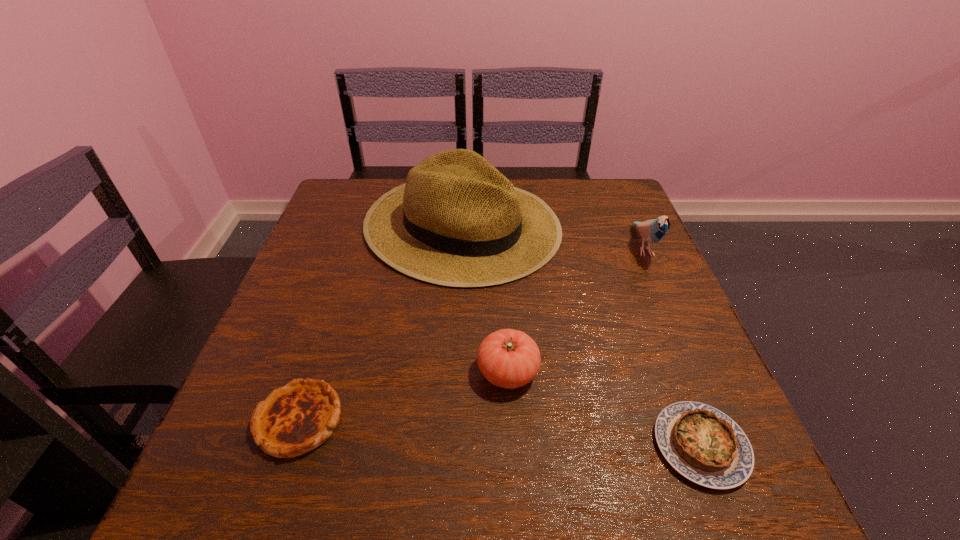
Where is `vacant space at the far edge of the desktop`? The image size is (960, 540). vacant space at the far edge of the desktop is located at coordinates (570, 227).

What are the coordinates of `blank area at the near edge` in the screenshot? It's located at (399, 481).

The width and height of the screenshot is (960, 540). In order to click on vacant space at the left edge of the desktop in this screenshot , I will do `click(346, 269)`.

The height and width of the screenshot is (540, 960). In order to click on vacant region at the right edge of the desktop in this screenshot , I will do `click(606, 276)`.

Identify the location of vacant point at the far left corner. The height and width of the screenshot is (540, 960). (354, 201).

The image size is (960, 540). Find the location of `vacant region at the far right corner of the desktop`. vacant region at the far right corner of the desktop is located at coordinates (590, 219).

The height and width of the screenshot is (540, 960). I want to click on free spot between the left quiche and the tallest object, so click(380, 323).

Where is `empty location between the tomato and the right quiche`? The image size is (960, 540). empty location between the tomato and the right quiche is located at coordinates (605, 409).

This screenshot has height=540, width=960. In order to click on free space between the left quiche and the third shortest object in this screenshot , I will do `click(403, 396)`.

You are a GUI agent. You are given a task and a screenshot of the screen. Output one action in this format:
    pyautogui.click(x=<x>, y=<y>)
    Task: Click on the vacant space in between the tallest object and the third tallest object
    
    Given the screenshot: What is the action you would take?
    pyautogui.click(x=485, y=299)